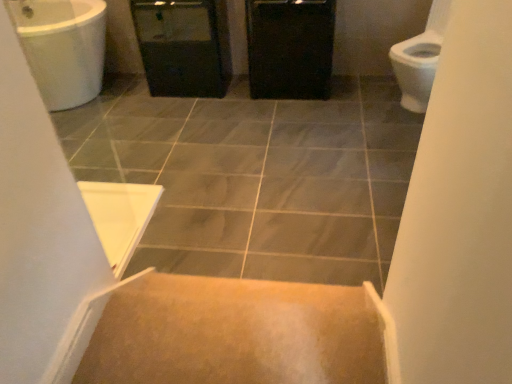
Question: From the image's perspective, is black plastic screen door at center located beneath gray tile at center?

Choices:
 (A) no
 (B) yes

Answer: (A)

Question: Is black plastic screen door at center not close to gray tile at center?

Choices:
 (A) yes
 (B) no

Answer: (B)

Question: Can you confirm if black plastic screen door at center is wider than gray tile at center?

Choices:
 (A) no
 (B) yes

Answer: (A)

Question: From a real-world perspective, does black plastic screen door at center stand above gray tile at center?

Choices:
 (A) yes
 (B) no

Answer: (A)

Question: Can you confirm if black plastic screen door at center is positioned to the right of gray tile at center?

Choices:
 (A) yes
 (B) no

Answer: (B)

Question: Is black plastic screen door at center oriented towards gray tile at center?

Choices:
 (A) yes
 (B) no

Answer: (A)

Question: Is gray tile at center looking in the opposite direction of black plastic screen door at center?

Choices:
 (A) no
 (B) yes

Answer: (A)

Question: Are gray tile at center and black plastic screen door at center making contact?

Choices:
 (A) yes
 (B) no

Answer: (B)

Question: From the image's perspective, is gray tile at center over black plastic screen door at center?

Choices:
 (A) no
 (B) yes

Answer: (A)

Question: Would you say gray tile at center is a long distance from black plastic screen door at center?

Choices:
 (A) yes
 (B) no

Answer: (B)

Question: Is gray tile at center thinner than black plastic screen door at center?

Choices:
 (A) yes
 (B) no

Answer: (B)

Question: Is gray tile at center closer to camera compared to black plastic screen door at center?

Choices:
 (A) yes
 (B) no

Answer: (A)

Question: Does black plastic screen door at center have a lesser width compared to carpeted stairs at center?

Choices:
 (A) yes
 (B) no

Answer: (B)